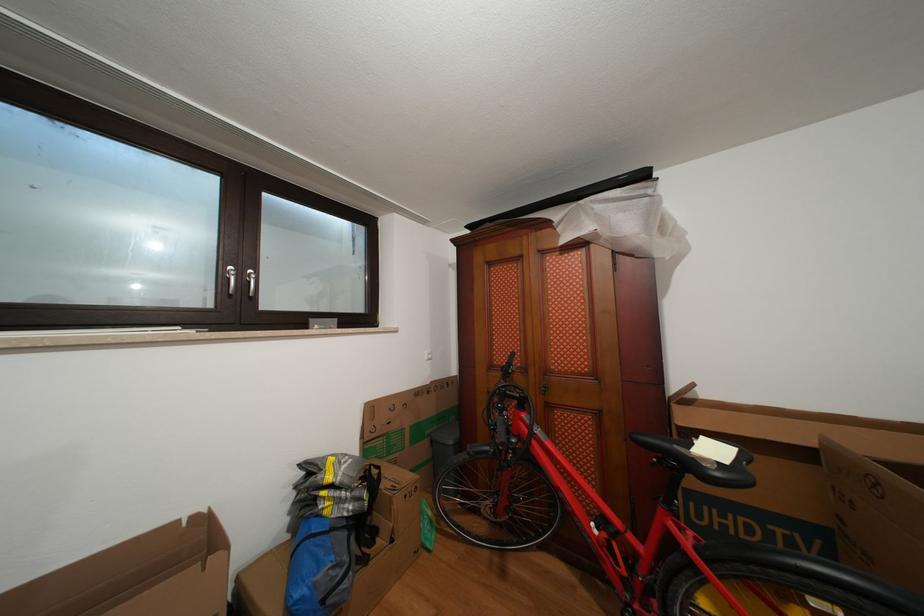
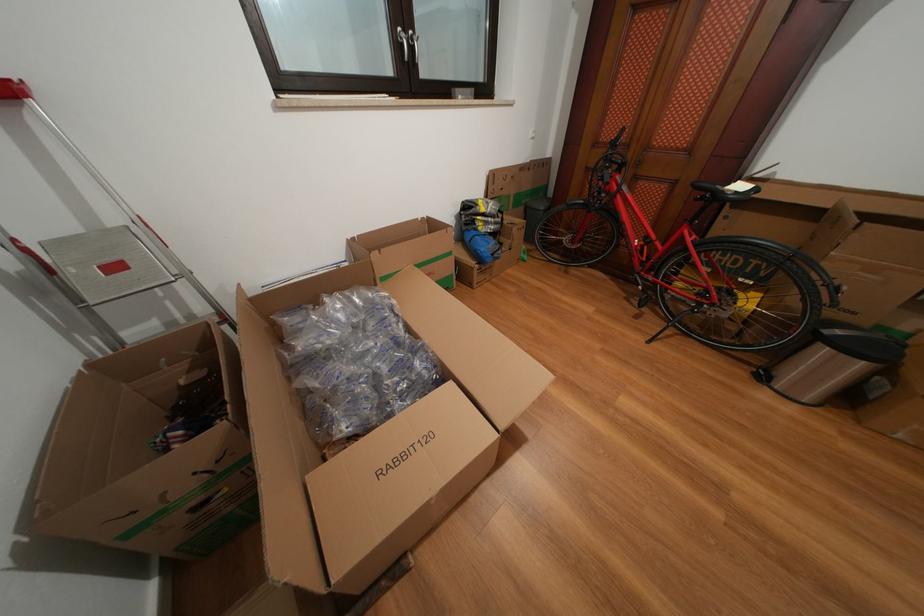
Find the pixel in the second image that matches [337,484] in the first image.

(491, 215)